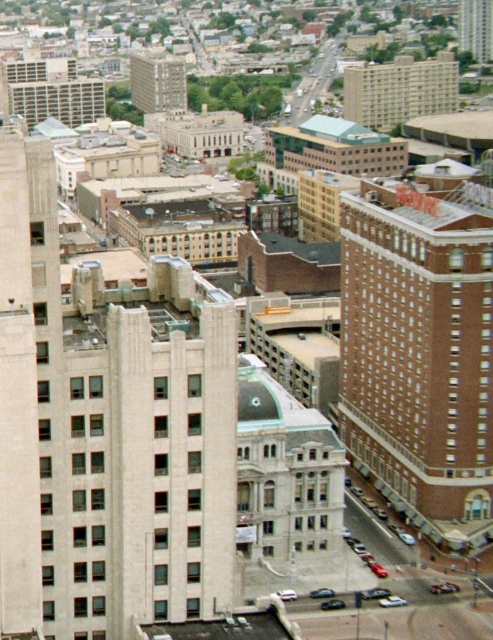
Question: Among these objects, which one is farthest from the camera?

Choices:
 (A) smooth glass skyscraper at upper right
 (B) brown brick building at right
 (C) beige brick building at upper center
 (D) beige brick building at center

Answer: (A)

Question: Does brown brick building at right lie in front of beige brick building at upper center?

Choices:
 (A) no
 (B) yes

Answer: (B)

Question: Which object is positioned closest to the beige brick building at upper center?

Choices:
 (A) brown brick building at right
 (B) beige brick building at center

Answer: (B)

Question: Is brown brick building at right wider than beige brick building at center?

Choices:
 (A) no
 (B) yes

Answer: (A)

Question: Based on their relative distances, which object is farther from the beige brick building at center?

Choices:
 (A) beige brick building at upper center
 (B) brown brick building at right
 (C) smooth glass skyscraper at upper right

Answer: (B)

Question: Is brown brick building at right thinner than beige brick building at center?

Choices:
 (A) no
 (B) yes

Answer: (B)